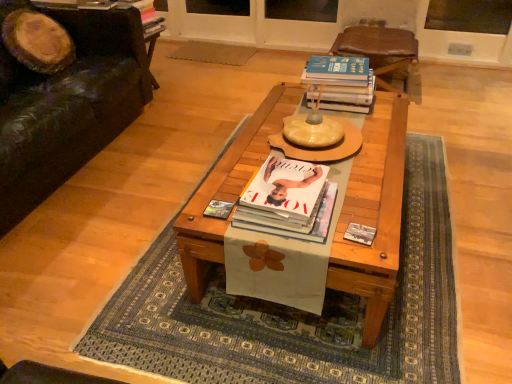
Image resolution: width=512 pixels, height=384 pixels. Identify the location of free space that is in between white glossy book at center, which is counted as the 2th book, starting from the right, and gray matte paperback book at center. (345, 223).